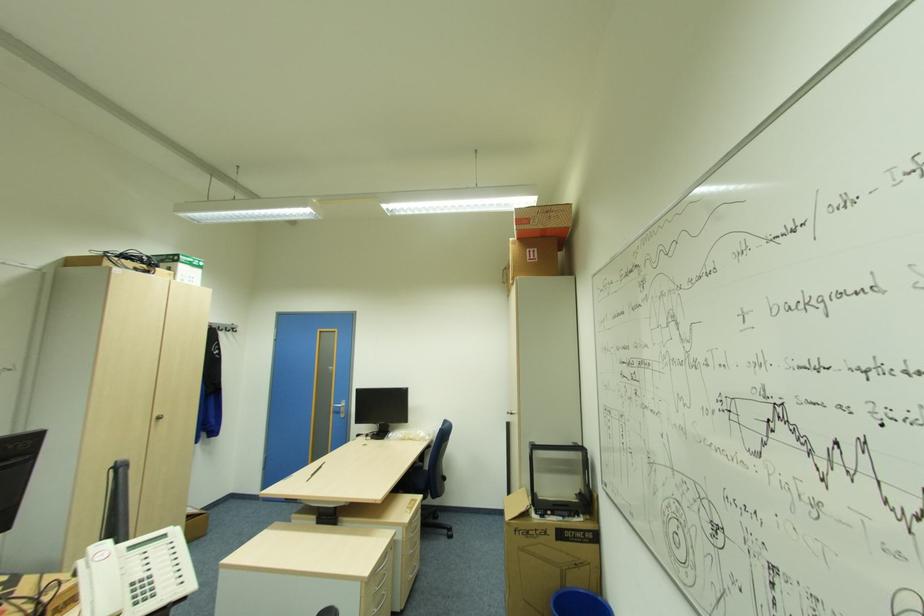
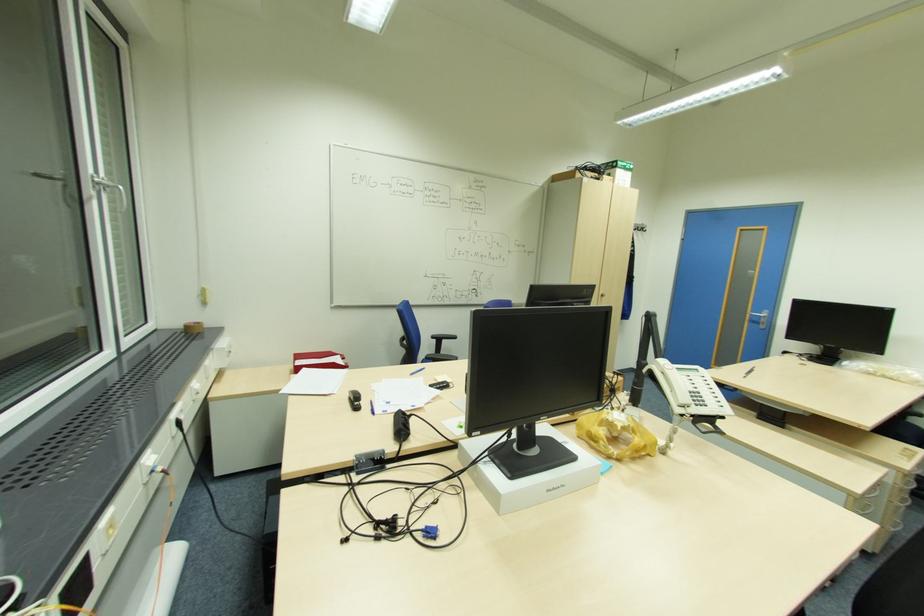
Locate, in the second image, the point that corresponds to (162,418) in the first image.

(604, 294)